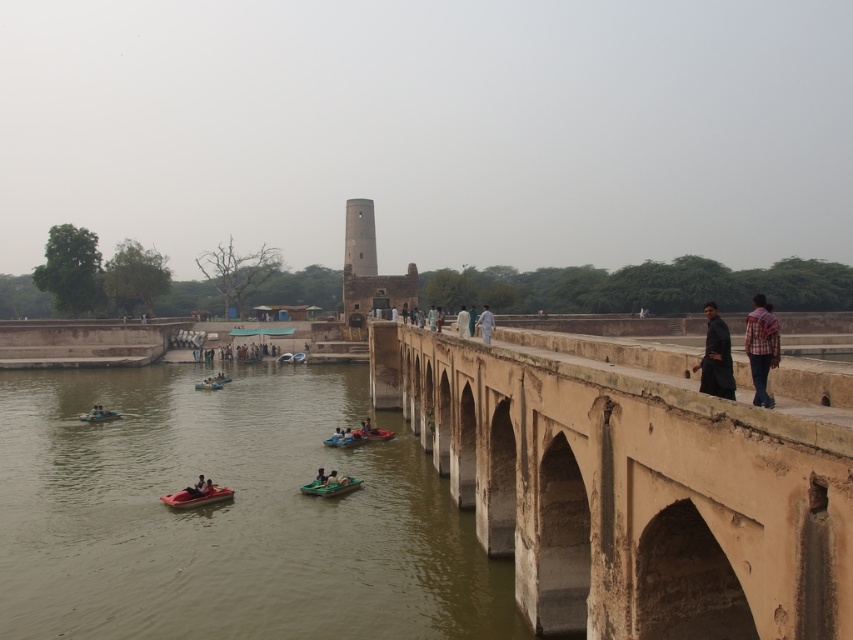
Is dark matte coat at right below white cotton dress at center?

Actually, dark matte coat at right is above white cotton dress at center.

Who is taller, dark matte coat at right or white cotton dress at center?

dark matte coat at right is taller.

Is point (721, 326) more distant than point (483, 328)?

No, (721, 326) is in front of (483, 328).

This screenshot has height=640, width=853. Find the location of `dark matte coat at right`. dark matte coat at right is located at coordinates (717, 356).

Can you confirm if green rubber boat at center is positioned below green fabric boat at lower center?

Indeed, green rubber boat at center is positioned under green fabric boat at lower center.

Who is shorter, green rubber boat at center or green fabric boat at lower center?

Standing shorter between the two is green fabric boat at lower center.

Where is `green rubber boat at center`? The image size is (853, 640). green rubber boat at center is located at coordinates (331, 486).

Who is more distant from viewer, (376, 401) or (405, 269)?

Point (405, 269)

Which is in front, point (674, 627) or point (366, 252)?

Point (674, 627) is in front.

Which is in front, point (816, 618) or point (408, 289)?

Positioned in front is point (816, 618).

I want to click on beige stone bridge at center, so click(630, 490).